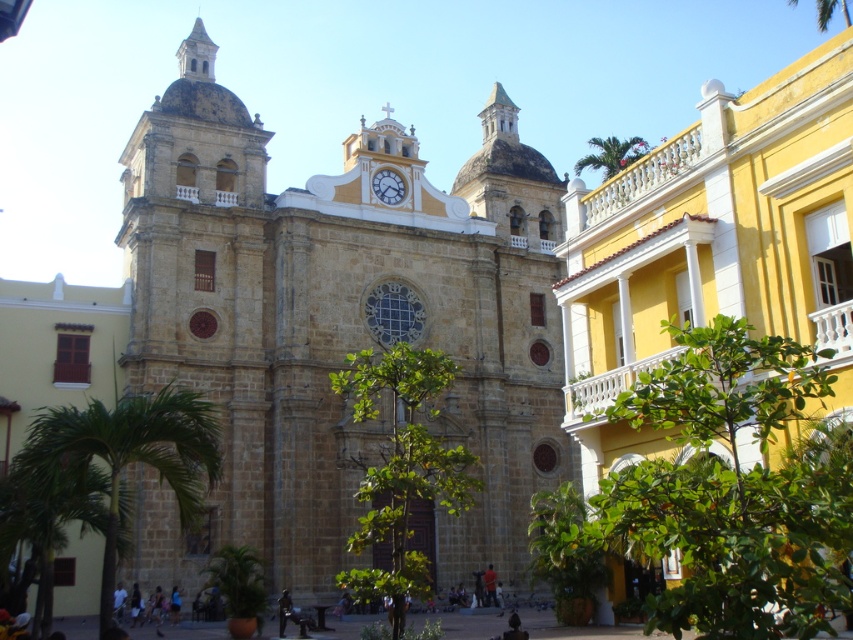
You are standing at the point marked as point (132, 452) in the image. What do you see directly in front of you?

You see a green leafy palm tree at left directly in front of you.

You are standing at the center of the plaza in front of the historic church. You want to take a photo of the church with the green leafy palm tree at upper right in the background. Where should you position yourself relative to the church to ensure the palm tree appears in the upper right corner of your photo?

To include the green leafy palm tree at upper right in the upper right corner of your photo, position yourself slightly to the left of the church so that the palm tree at upper right is framed in the desired corner.